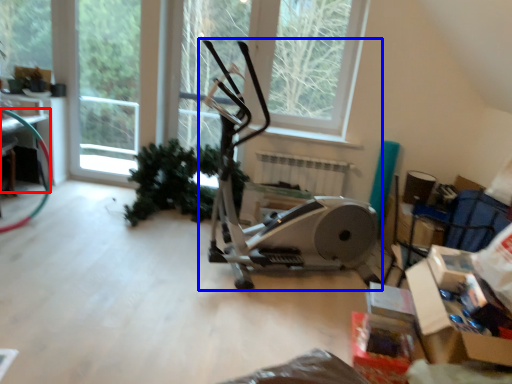
Question: Among these objects, which one is nearest to the camera, table (highlighted by a red box) or stationary bicycle (highlighted by a blue box)?

Choices:
 (A) table
 (B) stationary bicycle

Answer: (B)